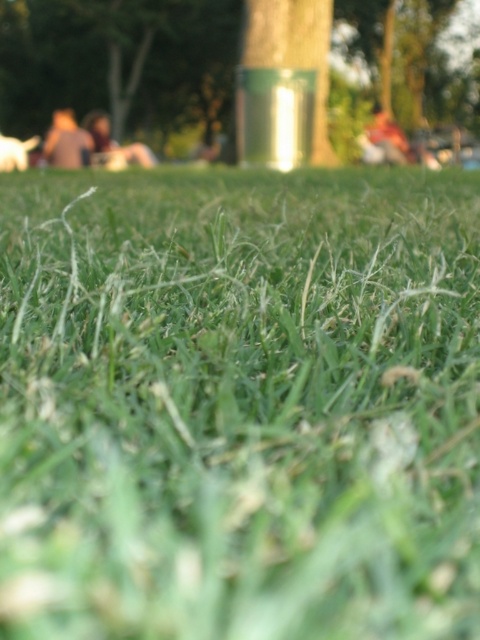
Question: Does green matte tree at center appear on the right side of light brown fabric person at left?

Choices:
 (A) yes
 (B) no

Answer: (A)

Question: Among these points, which one is farthest from the camera?

Choices:
 (A) (76, 157)
 (B) (109, 13)
 (C) (106, 147)
 (D) (255, 531)

Answer: (B)

Question: Which object is closer to the camera taking this photo?

Choices:
 (A) green grassy at center
 (B) light brown fabric person at left
 (C) green matte tree at center

Answer: (A)

Question: Is green grassy at center smaller than light brown fabric person at left?

Choices:
 (A) yes
 (B) no

Answer: (B)

Question: Is green matte tree at center to the right of blurred skin person at center from the viewer's perspective?

Choices:
 (A) yes
 (B) no

Answer: (A)

Question: Which object is closer to the camera taking this photo?

Choices:
 (A) green grassy at center
 (B) light brown fabric person at left
 (C) green matte tree at center
 (D) blurred skin person at center

Answer: (A)